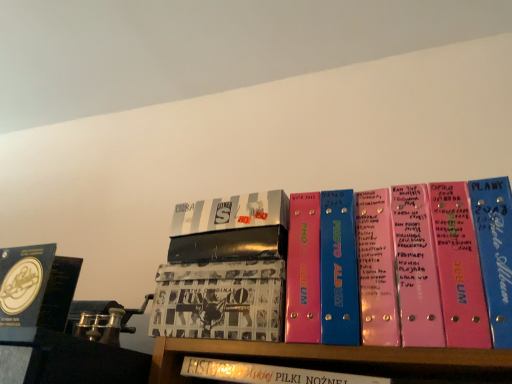
What do you see at coordinates (267, 373) in the screenshot?
I see `white leather book at center, acting as the 2th book starting from the right` at bounding box center [267, 373].

Find the location of a particular element. The height and width of the screenshot is (384, 512). white leather book at center, acting as the 2th book starting from the right is located at coordinates (267, 373).

How much space does blue matte album at left, marked as the fifth book in a right-to-left arrangement, occupy horizontally?

It is 7.82 centimeters.

The height and width of the screenshot is (384, 512). What do you see at coordinates (220, 301) in the screenshot?
I see `printed paper album at center, arranged as the fourth book when viewed from the right` at bounding box center [220, 301].

What do you see at coordinates (344, 268) in the screenshot? I see `pink plastic photo album at center, the 1th book viewed from the right` at bounding box center [344, 268].

Locate an element on the screen. metallic silver photo album at center, acting as the third book starting from the right is located at coordinates (231, 213).

Identify the location of book on the right of the white leather book at center, the 4th book from the left. (344, 268).

Does white leather book at center, acting as the 2th book starting from the right, appear on the left side of pink plastic photo album at center, the 1th book viewed from the right?

Correct, you'll find white leather book at center, acting as the 2th book starting from the right, to the left of pink plastic photo album at center, the 1th book viewed from the right.

How different are the orientations of white leather book at center, acting as the 2th book starting from the right, and pink plastic photo album at center, acting as the 5th book starting from the left, in degrees?

They differ by 2.11 degrees in their facing directions.

Which is farther, (x=259, y=377) or (x=298, y=229)?

The point (x=298, y=229) is behind.

Would you say pink plastic photo album at center, acting as the 5th book starting from the left, contains blue matte album at left, which ranks as the first book in left-to-right order?

No, pink plastic photo album at center, acting as the 5th book starting from the left, does not contain blue matte album at left, which ranks as the first book in left-to-right order.

Measure the distance between pink plastic photo album at center, acting as the 5th book starting from the left, and blue matte album at left, marked as the fifth book in a right-to-left arrangement.

pink plastic photo album at center, acting as the 5th book starting from the left, is 16.63 inches away from blue matte album at left, marked as the fifth book in a right-to-left arrangement.

Is point (395, 336) farther from camera compared to point (13, 321)?

No.

Is pink plastic photo album at center, acting as the 5th book starting from the left, further to the viewer compared to blue matte album at left, which ranks as the first book in left-to-right order?

No, it is not.

Do you think metallic silver photo album at center, acting as the third book starting from the right, is within blue matte album at left, marked as the fifth book in a right-to-left arrangement, or outside of it?

metallic silver photo album at center, acting as the third book starting from the right, is not inside blue matte album at left, marked as the fifth book in a right-to-left arrangement, it's outside.

Which is nearer, (197, 213) or (44, 310)?

The point (197, 213) is closer to the camera.

Does metallic silver photo album at center, acting as the third book starting from the right, have a greater height compared to blue matte album at left, marked as the fifth book in a right-to-left arrangement?

Incorrect, the height of metallic silver photo album at center, acting as the third book starting from the right, is not larger of that of blue matte album at left, marked as the fifth book in a right-to-left arrangement.

Can you confirm if printed paper album at center, positioned as the second book in left-to-right order, is thinner than pink plastic photo album at center, acting as the 5th book starting from the left?

No.

Is pink plastic photo album at center, the 1th book viewed from the right, located within printed paper album at center, arranged as the fourth book when viewed from the right?

No, pink plastic photo album at center, the 1th book viewed from the right, is not surrounded by printed paper album at center, arranged as the fourth book when viewed from the right.

From a real-world perspective, which object stands above the other?

In real-world perspective, pink plastic photo album at center, the 1th book viewed from the right, is above.

Is printed paper album at center, positioned as the second book in left-to-right order, behind pink plastic photo album at center, acting as the 5th book starting from the left?

That is True.

Are white leather book at center, acting as the 2th book starting from the right, and printed paper album at center, arranged as the fourth book when viewed from the right, located far from each other?

No, white leather book at center, acting as the 2th book starting from the right, is not far from printed paper album at center, arranged as the fourth book when viewed from the right.

Considering the relative sizes of white leather book at center, the 4th book from the left, and printed paper album at center, positioned as the second book in left-to-right order, in the image provided, is white leather book at center, the 4th book from the left, smaller than printed paper album at center, positioned as the second book in left-to-right order,?

Yes.

From the picture: From the image's perspective, is white leather book at center, the 4th book from the left, located above or below printed paper album at center, arranged as the fourth book when viewed from the right?

white leather book at center, the 4th book from the left, is situated lower than printed paper album at center, arranged as the fourth book when viewed from the right, in the image.

Is white leather book at center, acting as the 2th book starting from the right, at the right side of printed paper album at center, positioned as the second book in left-to-right order?

Yes.

Is printed paper album at center, arranged as the fourth book when viewed from the right, not close to metallic silver photo album at center, acting as the third book starting from the right?

No, printed paper album at center, arranged as the fourth book when viewed from the right, is in close proximity to metallic silver photo album at center, acting as the third book starting from the right.

Which is in front, printed paper album at center, arranged as the fourth book when viewed from the right, or metallic silver photo album at center, the third book positioned from the left?

printed paper album at center, arranged as the fourth book when viewed from the right, is closer to the camera.

Is printed paper album at center, arranged as the fourth book when viewed from the right, oriented towards metallic silver photo album at center, the third book positioned from the left?

No, printed paper album at center, arranged as the fourth book when viewed from the right, does not turn towards metallic silver photo album at center, the third book positioned from the left.

Is there a large distance between metallic silver photo album at center, acting as the third book starting from the right, and printed paper album at center, arranged as the fourth book when viewed from the right?

Actually, metallic silver photo album at center, acting as the third book starting from the right, and printed paper album at center, arranged as the fourth book when viewed from the right, are a little close together.

Which of these two, metallic silver photo album at center, acting as the third book starting from the right, or printed paper album at center, positioned as the second book in left-to-right order, is smaller?

With smaller size is metallic silver photo album at center, acting as the third book starting from the right.

Consider the image. From a real-world perspective, is metallic silver photo album at center, acting as the third book starting from the right, positioned under printed paper album at center, arranged as the fourth book when viewed from the right, based on gravity?

Incorrect, from a real-world perspective, metallic silver photo album at center, acting as the third book starting from the right, is higher than printed paper album at center, arranged as the fourth book when viewed from the right.

Is metallic silver photo album at center, acting as the third book starting from the right, oriented towards printed paper album at center, arranged as the fourth book when viewed from the right?

No, metallic silver photo album at center, acting as the third book starting from the right, is not turned towards printed paper album at center, arranged as the fourth book when viewed from the right.

This screenshot has width=512, height=384. I want to click on the 3rd book above the white leather book at center, acting as the 2th book starting from the right (from the image's perspective), so click(x=344, y=268).

Find the location of a particular element. the 4th book in front of the blue matte album at left, marked as the fifth book in a right-to-left arrangement is located at coordinates (344, 268).

Considering their positions, is printed paper album at center, arranged as the fourth book when viewed from the right, positioned further to white leather book at center, acting as the 2th book starting from the right, than blue matte album at left, which ranks as the first book in left-to-right order?

blue matte album at left, which ranks as the first book in left-to-right order, is positioned further to the anchor white leather book at center, acting as the 2th book starting from the right.

From the image, which object appears to be farther from blue matte album at left, marked as the fifth book in a right-to-left arrangement, metallic silver photo album at center, the third book positioned from the left, or printed paper album at center, arranged as the fourth book when viewed from the right?

metallic silver photo album at center, the third book positioned from the left, is positioned further to the anchor blue matte album at left, marked as the fifth book in a right-to-left arrangement.

Based on their spatial positions, is metallic silver photo album at center, acting as the third book starting from the right, or blue matte album at left, marked as the fifth book in a right-to-left arrangement, closer to white leather book at center, the 4th book from the left?

The object closer to white leather book at center, the 4th book from the left, is metallic silver photo album at center, acting as the third book starting from the right.

Consider the image. Estimate the real-world distances between objects in this image. Which object is closer to metallic silver photo album at center, the third book positioned from the left, pink plastic photo album at center, acting as the 5th book starting from the left, or printed paper album at center, arranged as the fourth book when viewed from the right?

The object closer to metallic silver photo album at center, the third book positioned from the left, is printed paper album at center, arranged as the fourth book when viewed from the right.

From the picture: From the image, which object appears to be nearer to blue matte album at left, marked as the fifth book in a right-to-left arrangement, metallic silver photo album at center, the third book positioned from the left, or pink plastic photo album at center, the 1th book viewed from the right?

metallic silver photo album at center, the third book positioned from the left, lies closer to blue matte album at left, marked as the fifth book in a right-to-left arrangement, than the other object.

When comparing their distances from white leather book at center, acting as the 2th book starting from the right, does printed paper album at center, positioned as the second book in left-to-right order, or pink plastic photo album at center, acting as the 5th book starting from the left, seem further?

Based on the image, pink plastic photo album at center, acting as the 5th book starting from the left, appears to be further to white leather book at center, acting as the 2th book starting from the right.

When comparing their distances from pink plastic photo album at center, the 1th book viewed from the right, does blue matte album at left, marked as the fifth book in a right-to-left arrangement, or printed paper album at center, arranged as the fourth book when viewed from the right, seem further?

Among the two, blue matte album at left, marked as the fifth book in a right-to-left arrangement, is located further to pink plastic photo album at center, the 1th book viewed from the right.

Which object lies further to the anchor point pink plastic photo album at center, acting as the 5th book starting from the left, printed paper album at center, positioned as the second book in left-to-right order, or white leather book at center, acting as the 2th book starting from the right?

Based on the image, white leather book at center, acting as the 2th book starting from the right, appears to be further to pink plastic photo album at center, acting as the 5th book starting from the left.

Where is `book between blue matte album at left, marked as the fifth book in a right-to-left arrangement, and metallic silver photo album at center, the third book positioned from the left, in the horizontal direction`? This screenshot has height=384, width=512. book between blue matte album at left, marked as the fifth book in a right-to-left arrangement, and metallic silver photo album at center, the third book positioned from the left, in the horizontal direction is located at coordinates (220, 301).